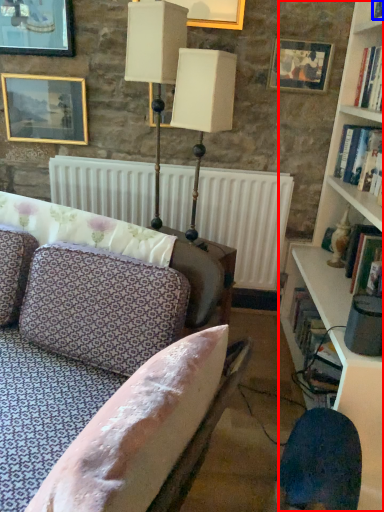
Question: Which point is further to the camera, bookcase (highlighted by a red box) or book (highlighted by a blue box)?

Choices:
 (A) bookcase
 (B) book

Answer: (B)